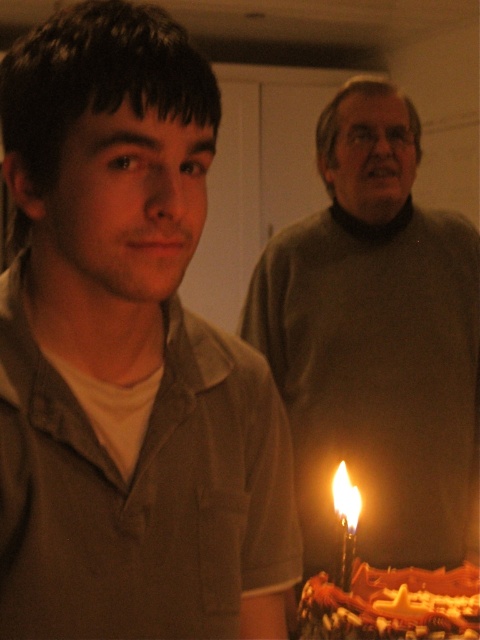
Who is more distant from viewer, (478,417) or (350,493)?

Point (478,417)

Can you confirm if matte gray sweater at center is smaller than flametransparentbirthday candle at center?

No, matte gray sweater at center is not smaller than flametransparentbirthday candle at center.

Who is more forward, [362,385] or [348,484]?

Point [348,484] is in front.

At what (x,y) coordinates should I click in order to perform the action: click on matte gray sweater at center. Please return your answer as a coordinate pair (x, y). Looking at the image, I should click on (375, 340).

Is point (414, 588) in front of point (348, 554)?

No, (414, 588) is further to viewer.

Is point (463, 628) positioned after point (335, 476)?

That is False.

At what (x,y) coordinates should I click in order to perform the action: click on chocolate frosted cake at lower right. Please return your answer as a coordinate pair (x, y). Image resolution: width=480 pixels, height=640 pixels. Looking at the image, I should click on 391,604.

Does matte brown shirt at center appear on the left side of chocolate frosted cake at lower right?

Indeed, matte brown shirt at center is positioned on the left side of chocolate frosted cake at lower right.

Describe the element at coordinates (127, 355) in the screenshot. This screenshot has height=640, width=480. I see `matte brown shirt at center` at that location.

Who is more forward, (192, 412) or (445, 592)?

Positioned in front is point (192, 412).

The height and width of the screenshot is (640, 480). Identify the location of matte brown shirt at center. (127, 355).